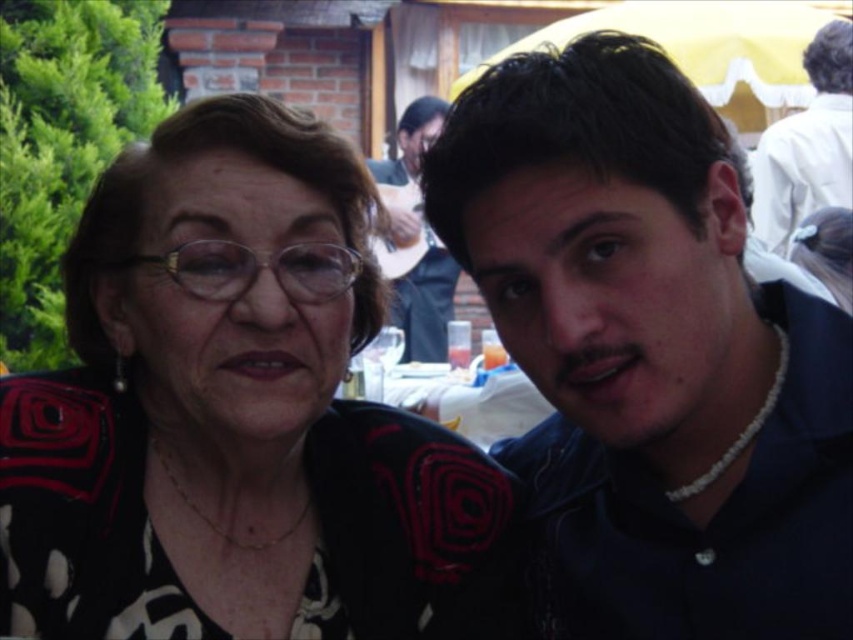
Does white shirt at upper right appear on the right side of smooth black shirt at right?

Yes, white shirt at upper right is to the right of smooth black shirt at right.

Consider the image. Is white shirt at upper right bigger than smooth black shirt at right?

Yes, white shirt at upper right is bigger than smooth black shirt at right.

Which is in front, point (825, 36) or point (413, 154)?

Point (825, 36) is more forward.

Find the location of a particular element. This screenshot has width=853, height=640. white shirt at upper right is located at coordinates [807, 145].

Is smooth black shirt at right below white plastic table at center?

Actually, smooth black shirt at right is above white plastic table at center.

Is smooth black shirt at right to the left of white plastic table at center from the viewer's perspective?

Indeed, smooth black shirt at right is positioned on the left side of white plastic table at center.

This screenshot has height=640, width=853. I want to click on smooth black shirt at right, so click(421, 289).

This screenshot has height=640, width=853. I want to click on smooth black shirt at right, so point(421,289).

The height and width of the screenshot is (640, 853). What do you see at coordinates (648, 355) in the screenshot?
I see `smooth blue shirt at right` at bounding box center [648, 355].

Is point (711, 278) positioned after point (813, 160)?

No, (711, 278) is in front of (813, 160).

This screenshot has height=640, width=853. Describe the element at coordinates (648, 355) in the screenshot. I see `smooth blue shirt at right` at that location.

Find the location of a particular element. The image size is (853, 640). smooth blue shirt at right is located at coordinates (648, 355).